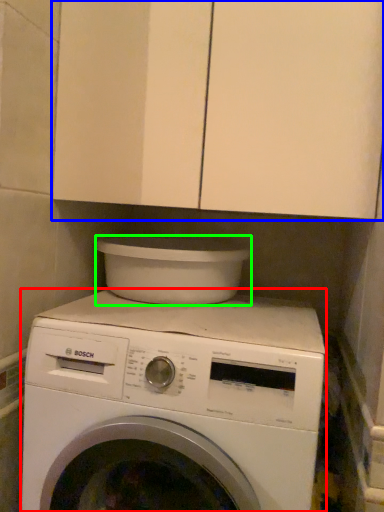
Question: Estimate the real-world distances between objects in this image. Which object is closer to washing machine (highlighted by a red box), cabinetry (highlighted by a blue box) or appliance (highlighted by a green box)?

Choices:
 (A) cabinetry
 (B) appliance

Answer: (B)